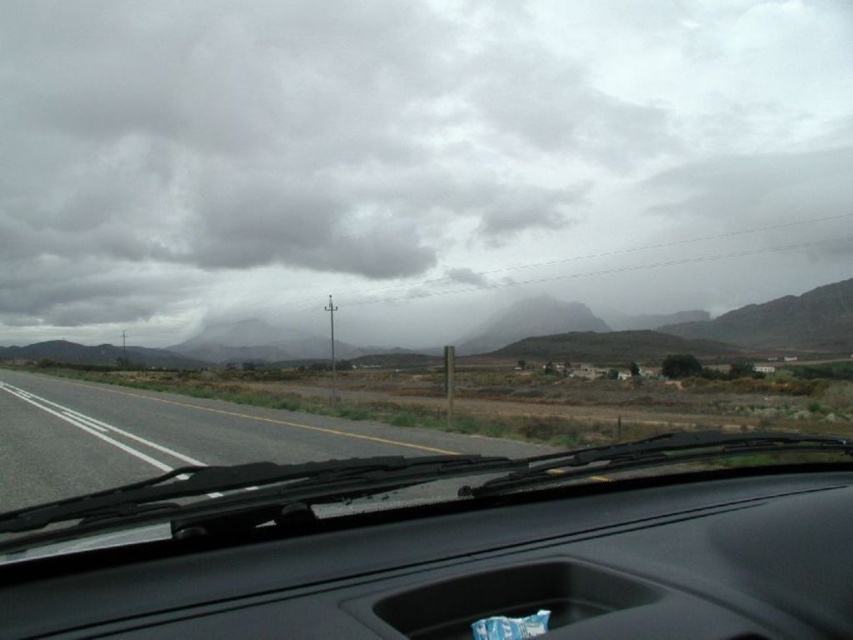
You are driving a car and looking out the windshield. You see the gray cloudy sky at upper center and the asphalt road at left. Which object is positioned to the right of the other?

The gray cloudy sky at upper center is to the right of asphalt road at left.

In the scene shown: You are driving a car and looking through the windshield. You notice the gray cloudy sky at upper center and the asphalt road at left. Which object appears taller in your view?

The gray cloudy sky at upper center appears taller than the asphalt road at left in your view.

You are driving and need to check both the black matte dashboard at center and the asphalt road at left. Which object is nearer to you?

The black matte dashboard at center is closer to the viewer than the asphalt road at left.